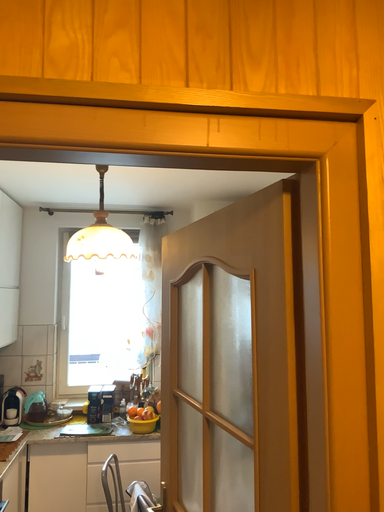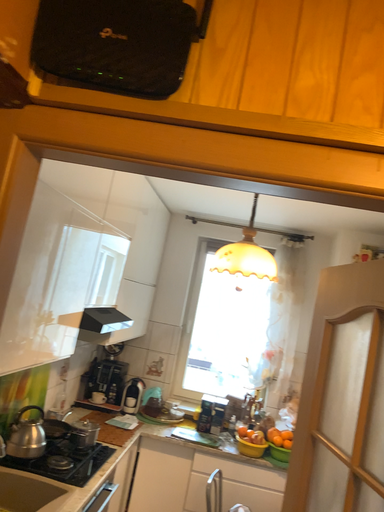
Question: How did the camera likely rotate when shooting the video?

Choices:
 (A) rotated right
 (B) rotated left

Answer: (B)